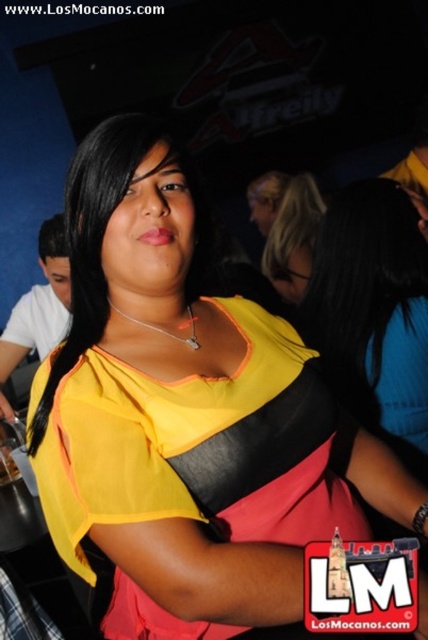
Question: Can you confirm if yellow matte shirt at center is smaller than translucent glass beverage at center?

Choices:
 (A) yes
 (B) no

Answer: (B)

Question: In this image, where is matte black hair at upper center located relative to translucent glass beverage at center?

Choices:
 (A) right
 (B) left

Answer: (A)

Question: Which point is closer to the camera taking this photo?

Choices:
 (A) (321, 257)
 (B) (315, 234)
 (C) (8, 445)

Answer: (A)

Question: Is matte black hair at upper center wider than translucent glass beverage at center?

Choices:
 (A) no
 (B) yes

Answer: (B)

Question: Estimate the real-world distances between objects in this image. Which object is closer to the matte black hair at upper center?

Choices:
 (A) yellow matte shirt at center
 (B) translucent glass beverage at center

Answer: (A)

Question: Which point is farther to the camera?

Choices:
 (A) matte black hair at upper center
 (B) yellow matte shirt at center
 (C) translucent glass beverage at center

Answer: (A)